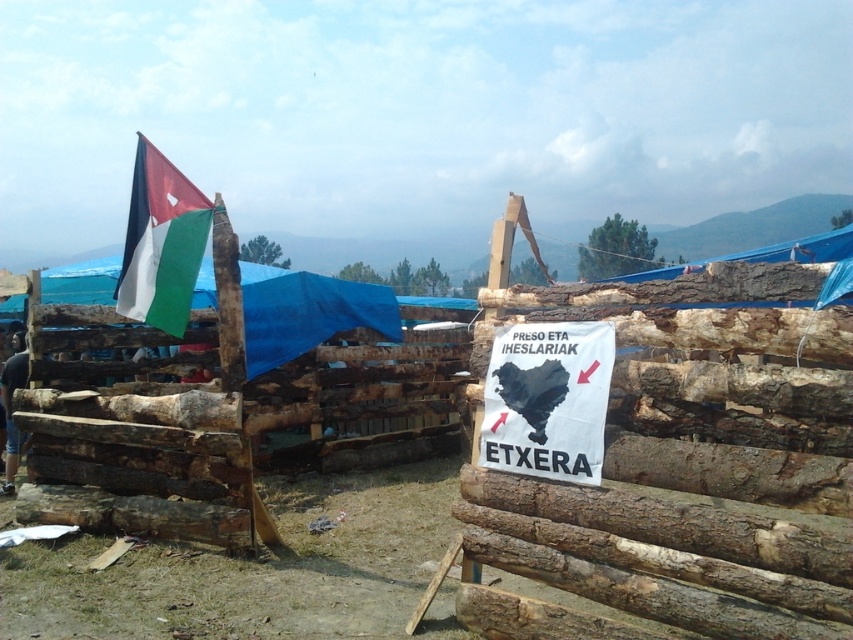
Question: Does matte fabric flag at upper left appear under dark blue jeans at left?

Choices:
 (A) yes
 (B) no

Answer: (B)

Question: Does matte fabric flag at upper left appear under dark blue jeans at left?

Choices:
 (A) yes
 (B) no

Answer: (B)

Question: Where is matte fabric flag at upper left located in relation to dark blue jeans at left in the image?

Choices:
 (A) below
 (B) above

Answer: (B)